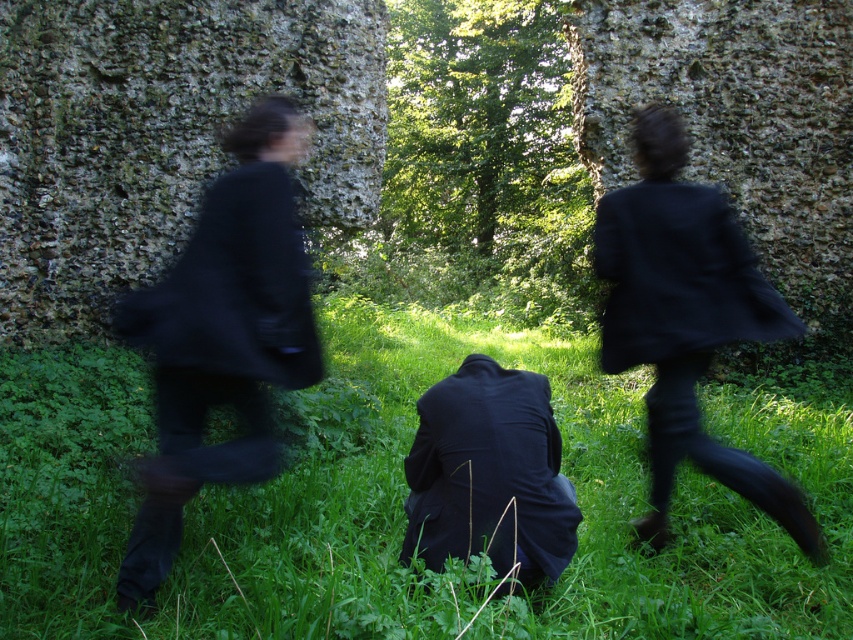
Is green grass at center smaller than matte black suit at left?

Correct, green grass at center occupies less space than matte black suit at left.

Does green grass at center have a larger size compared to matte black suit at left?

Incorrect, green grass at center is not larger than matte black suit at left.

Which is behind, point (367, 509) or point (247, 220)?

The point (367, 509) is more distant.

In order to click on green grass at center in this screenshot , I will do `click(561, 470)`.

Can you confirm if matte black suit at left is positioned above matte black coat at right?

Yes, matte black suit at left is above matte black coat at right.

Can you confirm if matte black suit at left is positioned below matte black coat at right?

Incorrect, matte black suit at left is not positioned below matte black coat at right.

Between point (231, 204) and point (709, 198), which one is positioned in front?

Point (231, 204) is more forward.

Find the location of a particular element. matte black suit at left is located at coordinates (222, 337).

Is matte black coat at right positioned in front of matte black suit at center?

No.

Does matte black coat at right appear on the right side of matte black suit at center?

Indeed, matte black coat at right is positioned on the right side of matte black suit at center.

Is point (697, 364) farther from viewer compared to point (511, 369)?

That is False.

Where is `matte black coat at right`? matte black coat at right is located at coordinates (686, 317).